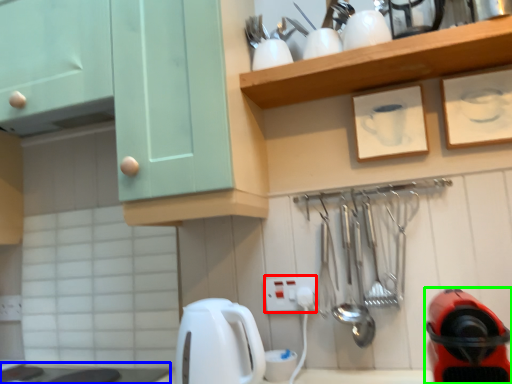
Question: Based on their relative distances, which object is farther from electric outlet (highlighted by a red box)? Choose from counter top (highlighted by a blue box) and home appliance (highlighted by a green box).

Choices:
 (A) counter top
 (B) home appliance

Answer: (A)